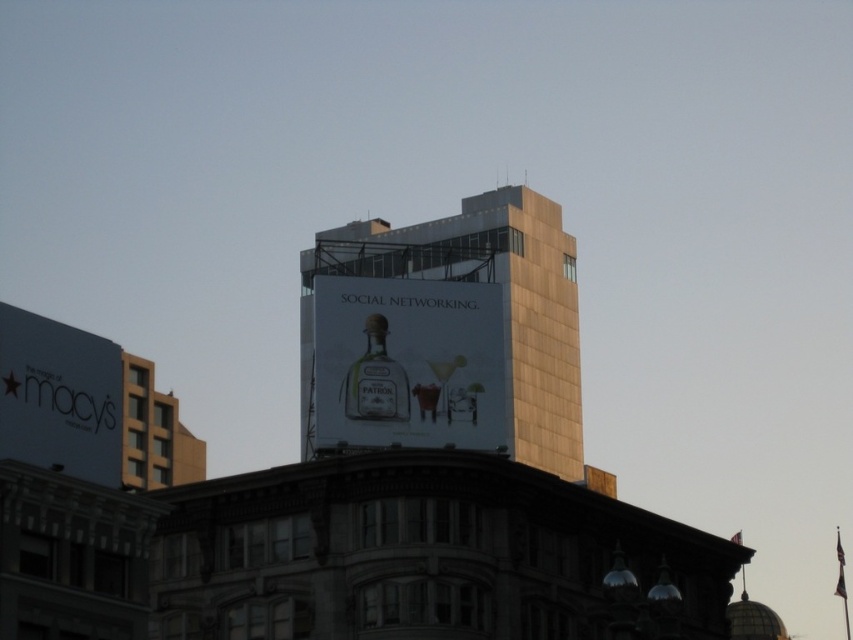
Does matte glass bottle at upper center have a lesser width compared to white glossy sign at lower left?

No, matte glass bottle at upper center is not thinner than white glossy sign at lower left.

Measure the distance from matte glass bottle at upper center to white glossy sign at lower left.

A distance of 35.75 feet exists between matte glass bottle at upper center and white glossy sign at lower left.

The image size is (853, 640). What do you see at coordinates (408, 364) in the screenshot?
I see `matte glass bottle at upper center` at bounding box center [408, 364].

Identify the location of matte glass bottle at upper center. The width and height of the screenshot is (853, 640). (408, 364).

Is gold metallic building at center to the left of matte glass bottle at upper center from the viewer's perspective?

Indeed, gold metallic building at center is positioned on the left side of matte glass bottle at upper center.

From the picture: Between gold metallic building at center and matte glass bottle at upper center, which one is positioned lower?

gold metallic building at center

This screenshot has height=640, width=853. What do you see at coordinates (503, 305) in the screenshot? I see `gold metallic building at center` at bounding box center [503, 305].

This screenshot has width=853, height=640. Identify the location of gold metallic building at center. (503, 305).

Between gold metallic building at center and clear glass bottle at center, which one appears on the left side from the viewer's perspective?

clear glass bottle at center is more to the left.

Is gold metallic building at center thinner than clear glass bottle at center?

In fact, gold metallic building at center might be wider than clear glass bottle at center.

Does point (563, 442) come farther from viewer compared to point (372, 328)?

Yes, it is behind point (372, 328).

You are a GUI agent. You are given a task and a screenshot of the screen. Output one action in this format:
    pyautogui.click(x=<x>, y=<y>)
    Task: Click on the gold metallic building at center
    The height and width of the screenshot is (640, 853).
    Given the screenshot: What is the action you would take?
    coord(503,305)